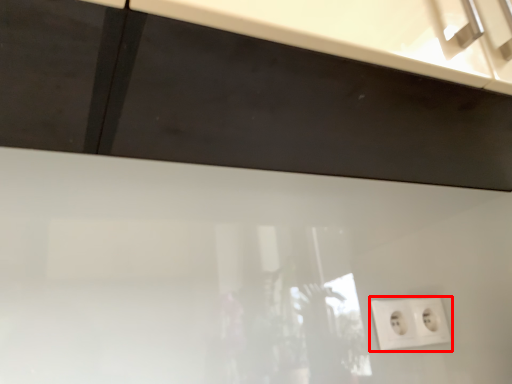
Question: Considering the relative positions of power plugs and sockets (annotated by the red box) and cabinetry in the image provided, where is power plugs and sockets (annotated by the red box) located with respect to the staircase?

Choices:
 (A) left
 (B) right

Answer: (B)